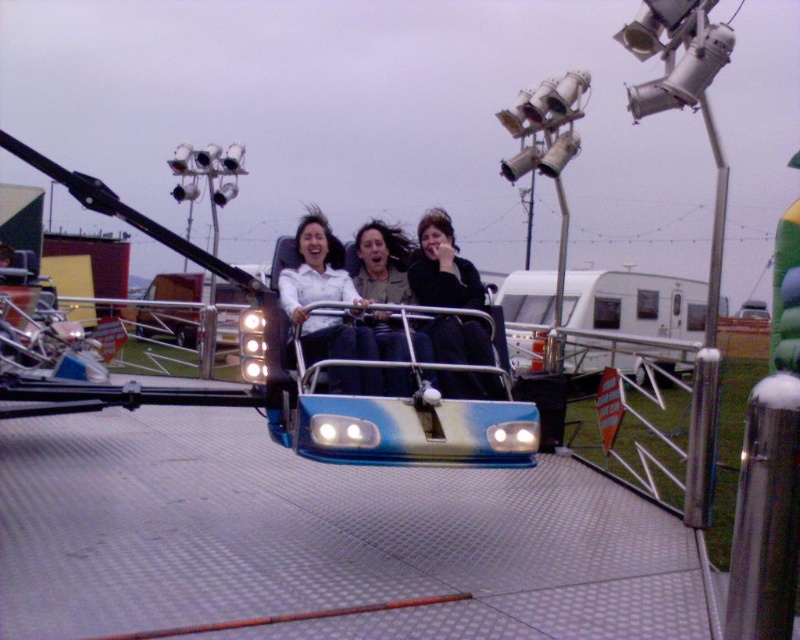
Does black matte jacket at center have a smaller size compared to matte black jacket at center?

Incorrect, black matte jacket at center is not smaller in size than matte black jacket at center.

Which is behind, point (480, 291) or point (389, 276)?

The point (389, 276) is behind.

Where is `black matte jacket at center`? The width and height of the screenshot is (800, 640). black matte jacket at center is located at coordinates (442, 268).

Identify the location of black matte jacket at center. (442, 268).

Measure the distance between point (312, 316) and camera.

Point (312, 316) and camera are 4.68 meters apart.

Is matte white shirt at center smaller than matte black jacket at center?

No, matte white shirt at center is not smaller than matte black jacket at center.

Where is `matte white shirt at center`? matte white shirt at center is located at coordinates (318, 291).

Does black matte jacket at center appear over matte white shirt at center?

No, black matte jacket at center is not above matte white shirt at center.

Is black matte jacket at center further to the viewer compared to matte white shirt at center?

Yes.

Is point (446, 276) more distant than point (346, 346)?

That is True.

Identify the location of black matte jacket at center. (442, 268).